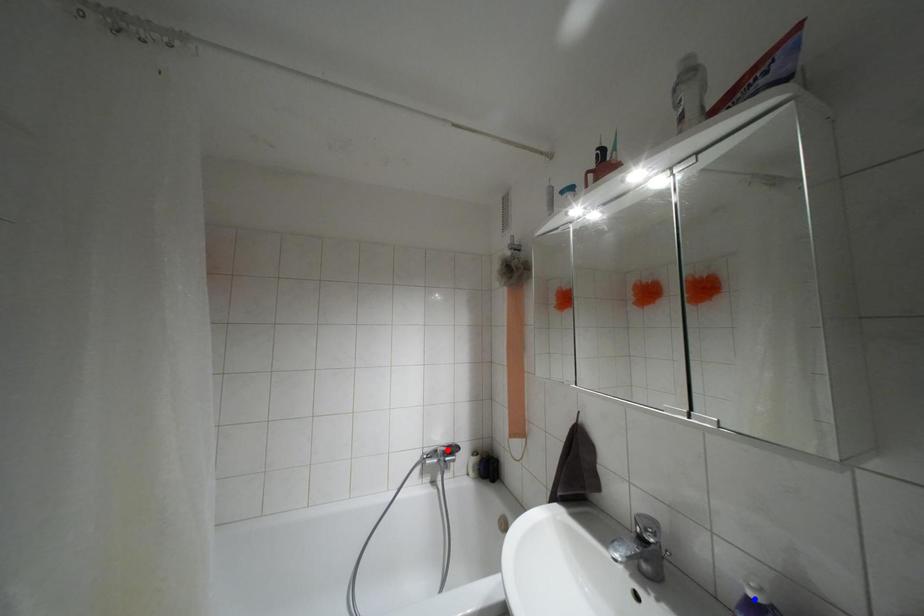
Question: In the image, two points are highlighted. Which point is nearer to the camera? Reply with the corresponding letter.

Choices:
 (A) blue point
 (B) red point

Answer: (A)